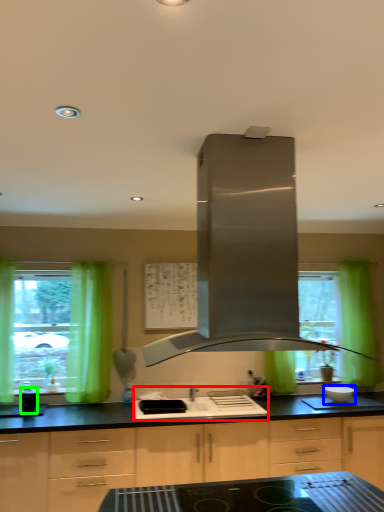
Question: Which object is positioned farthest from sink (highlighted by a red box)? Select from kitchen appliance (highlighted by a blue box) and appliance (highlighted by a green box).

Choices:
 (A) kitchen appliance
 (B) appliance

Answer: (B)